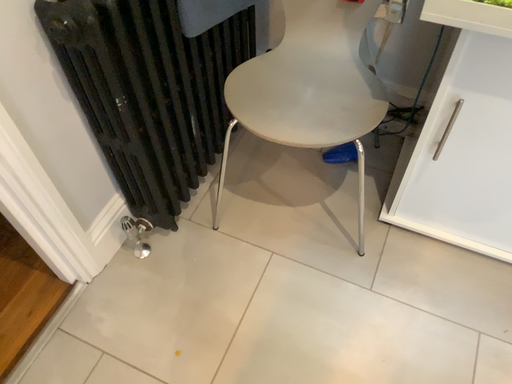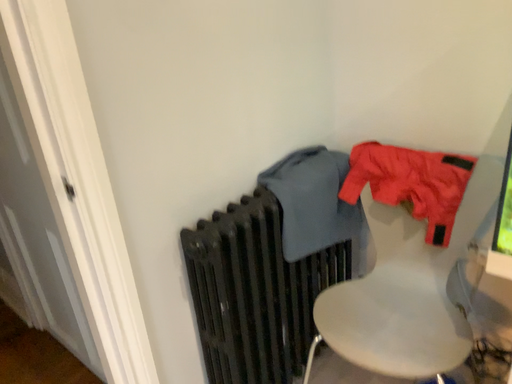
Question: Which way did the camera rotate in the video?

Choices:
 (A) rotated downward
 (B) rotated upward

Answer: (B)